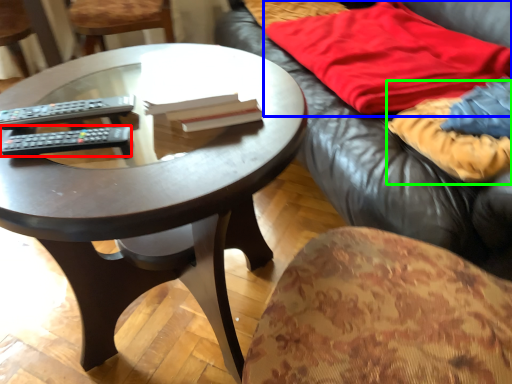
Question: Based on their relative distances, which object is farther from remote control (highlighted by a red box)? Choose from blanket (highlighted by a blue box) and blanket (highlighted by a green box).

Choices:
 (A) blanket
 (B) blanket

Answer: (A)